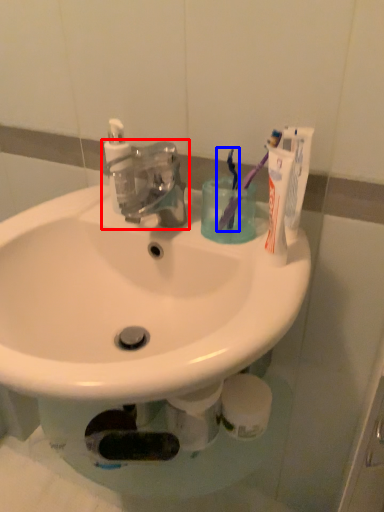
Question: Which object appears farthest to the camera in this image, tap (highlighted by a red box) or toothbrush (highlighted by a blue box)?

Choices:
 (A) tap
 (B) toothbrush

Answer: (B)